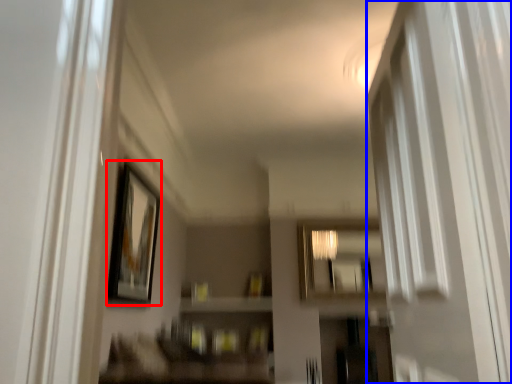
Question: Which object is further to the camera taking this photo, picture frame (highlighted by a red box) or screen door (highlighted by a blue box)?

Choices:
 (A) picture frame
 (B) screen door

Answer: (A)